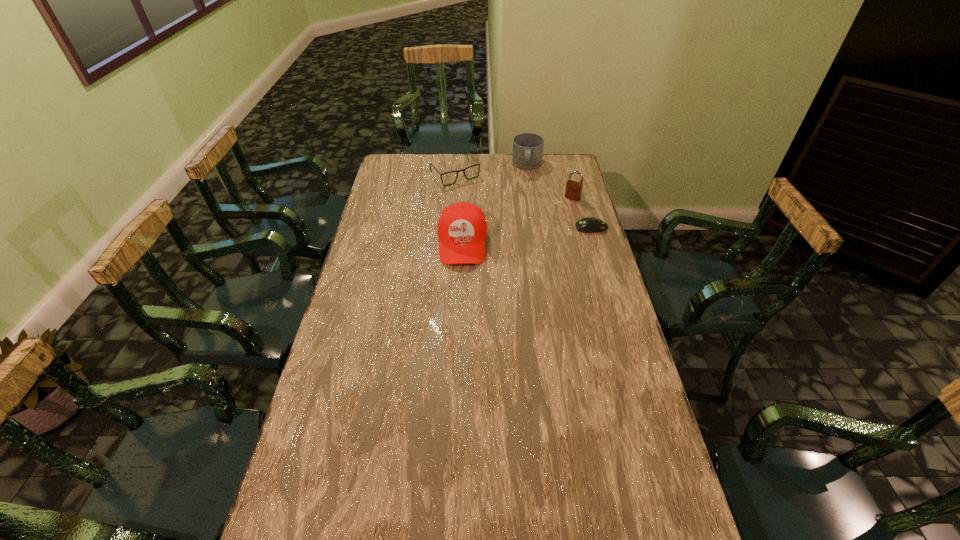
Find the location of `free space on the desktop that is between the baseball cap and the shortest object and is positioned on the lens of the second shortest object`. free space on the desktop that is between the baseball cap and the shortest object and is positioned on the lens of the second shortest object is located at coordinates tap(513, 237).

You are a GUI agent. You are given a task and a screenshot of the screen. Output one action in this format:
    pyautogui.click(x=<x>, y=<y>)
    Task: Click on the free space on the desktop that is between the baseball cap and the shortest object and is positioned on the front-facing side of the padlock
    
    Given the screenshot: What is the action you would take?
    pyautogui.click(x=544, y=233)

At what (x,y) coordinates should I click in order to perform the action: click on free space on the desktop that is between the baseball cap and the shortest object and is positioned on the side of the mug with the handle. Please return your answer as a coordinate pair (x, y). Looking at the image, I should click on (522, 236).